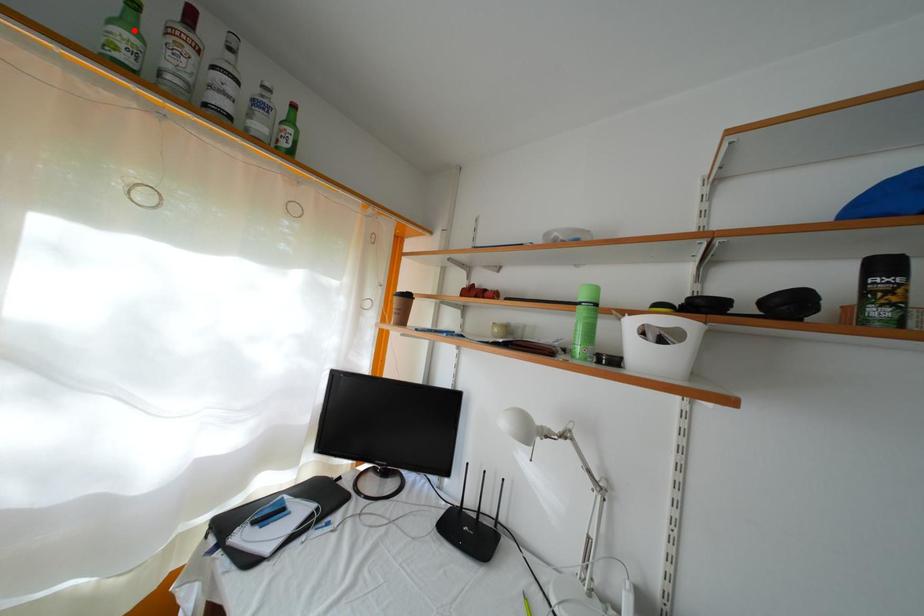
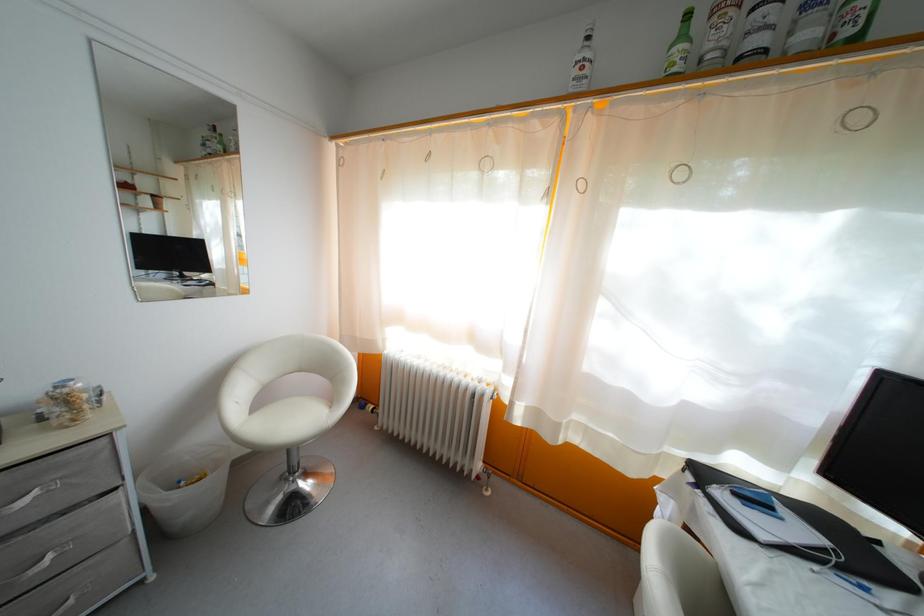
Find the pixel in the second image that matches the highlighted location in the first image.

(688, 43)